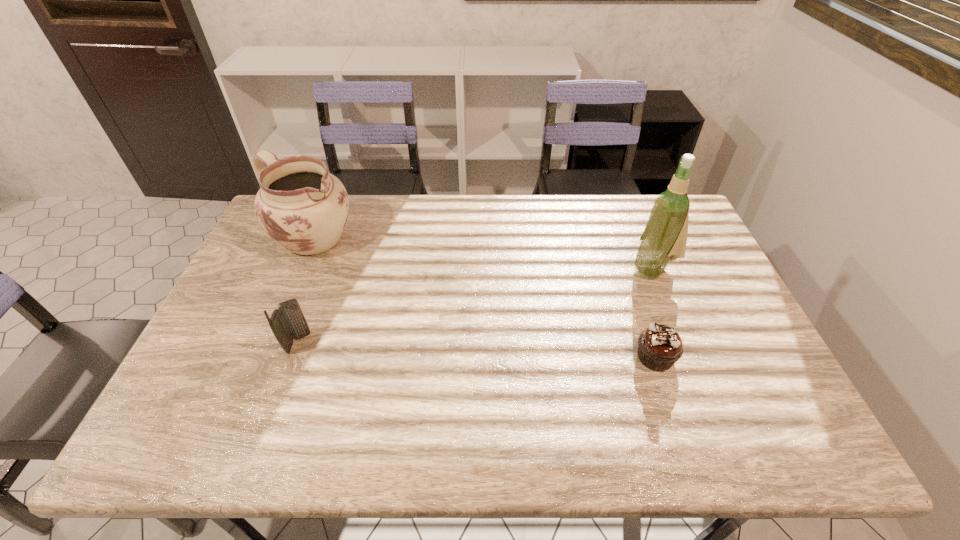
The height and width of the screenshot is (540, 960). I want to click on free space located on the front-facing side of the wine bottle, so click(x=551, y=322).

Where is `free space located 0.060m on the front-facing side of the wine bottle`? The width and height of the screenshot is (960, 540). free space located 0.060m on the front-facing side of the wine bottle is located at coordinates (622, 284).

At what (x,y) coordinates should I click in order to perform the action: click on object that is at the far edge. Please return your answer as a coordinate pair (x, y). This screenshot has height=540, width=960. Looking at the image, I should click on (300, 205).

I want to click on object that is at the left edge, so click(300, 205).

At what (x,y) coordinates should I click in order to perform the action: click on object at the right edge. Please return your answer as a coordinate pair (x, y). The height and width of the screenshot is (540, 960). Looking at the image, I should click on (664, 239).

Image resolution: width=960 pixels, height=540 pixels. What are the coordinates of `object situated at the far left corner` in the screenshot? It's located at (300, 205).

I want to click on free spot at the far edge of the desktop, so click(497, 226).

In order to click on free space at the near edge in this screenshot , I will do `click(331, 376)`.

The image size is (960, 540). In the image, there is a desktop. What are the coordinates of `free space at the left edge` in the screenshot? It's located at (231, 366).

Where is `vacant space at the right edge of the desktop`? This screenshot has height=540, width=960. vacant space at the right edge of the desktop is located at coordinates (684, 285).